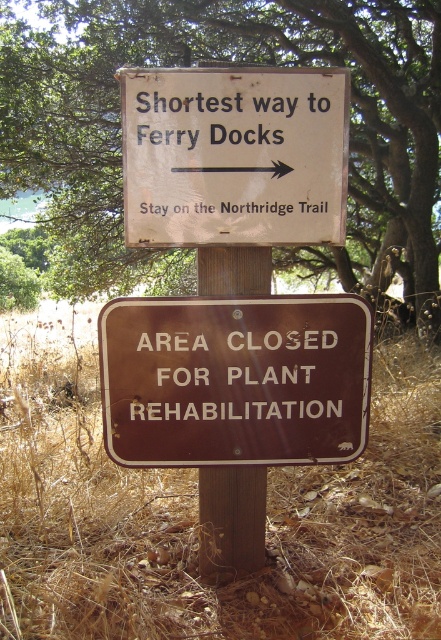
Question: Among these objects, which one is nearest to the camera?

Choices:
 (A) white paper sign at center
 (B) brown wooden sign at center

Answer: (A)

Question: Is the position of green leafy tree at upper center more distant than that of brown wood post at center?

Choices:
 (A) yes
 (B) no

Answer: (A)

Question: Can you confirm if white paper sign at center is bigger than brown wood post at center?

Choices:
 (A) no
 (B) yes

Answer: (B)

Question: Which object is farther from the camera taking this photo?

Choices:
 (A) green leafy tree at upper center
 (B) brown wooden sign at center

Answer: (A)

Question: Can you confirm if green leafy tree at upper center is wider than brown wooden sign at center?

Choices:
 (A) no
 (B) yes

Answer: (A)

Question: Among these points, which one is nearest to the camera?

Choices:
 (A) (133, 109)
 (B) (245, 547)
 (C) (200, 365)

Answer: (A)